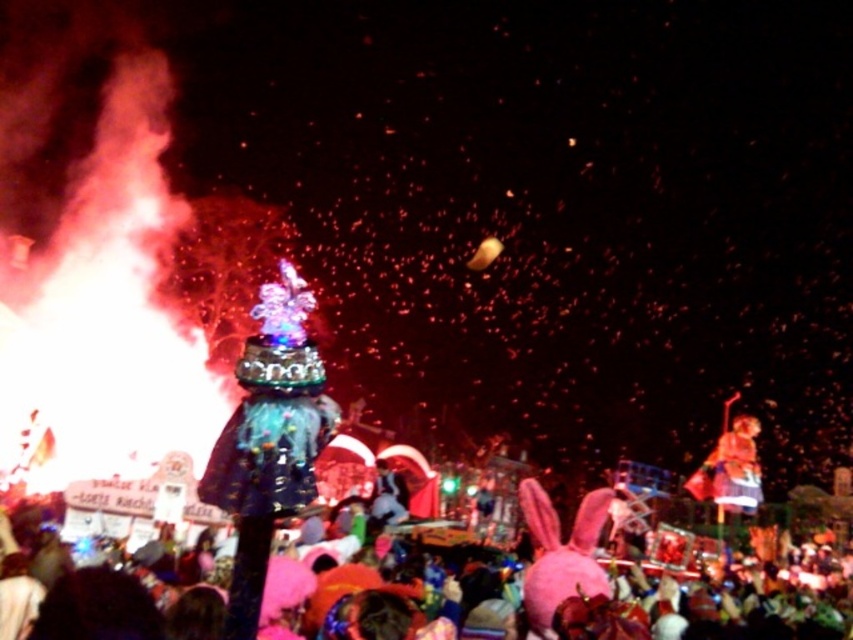
Question: Does pink fabric crowd at lower center have a lesser width compared to shiny gold statue at right?

Choices:
 (A) no
 (B) yes

Answer: (A)

Question: Which object is farther from the camera taking this photo?

Choices:
 (A) pink fabric crowd at lower center
 (B) shiny gold statue at right

Answer: (B)

Question: Does pink fabric crowd at lower center appear on the right side of shiny gold statue at right?

Choices:
 (A) yes
 (B) no

Answer: (B)

Question: Observing the image, what is the correct spatial positioning of pink fabric crowd at lower center in reference to shiny gold statue at right?

Choices:
 (A) below
 (B) above

Answer: (A)

Question: Which object is closer to the camera taking this photo?

Choices:
 (A) pink fabric crowd at lower center
 (B) shiny gold statue at right

Answer: (A)